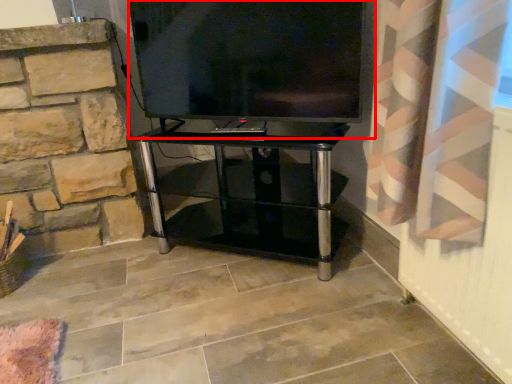
Question: From the image's perspective, where is television (annotated by the red box) located in relation to furniture in the image?

Choices:
 (A) below
 (B) above

Answer: (B)